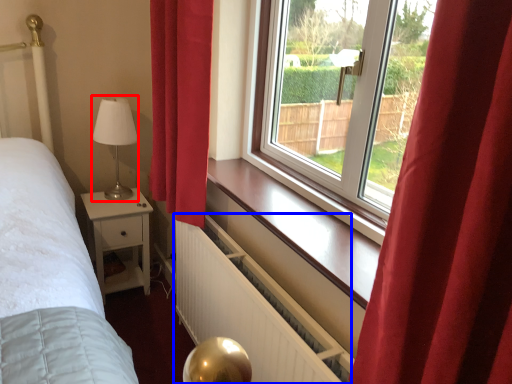
Question: Which of the following is the farthest to the observer, table lamp (highlighted by a red box) or radiator (highlighted by a blue box)?

Choices:
 (A) table lamp
 (B) radiator

Answer: (A)